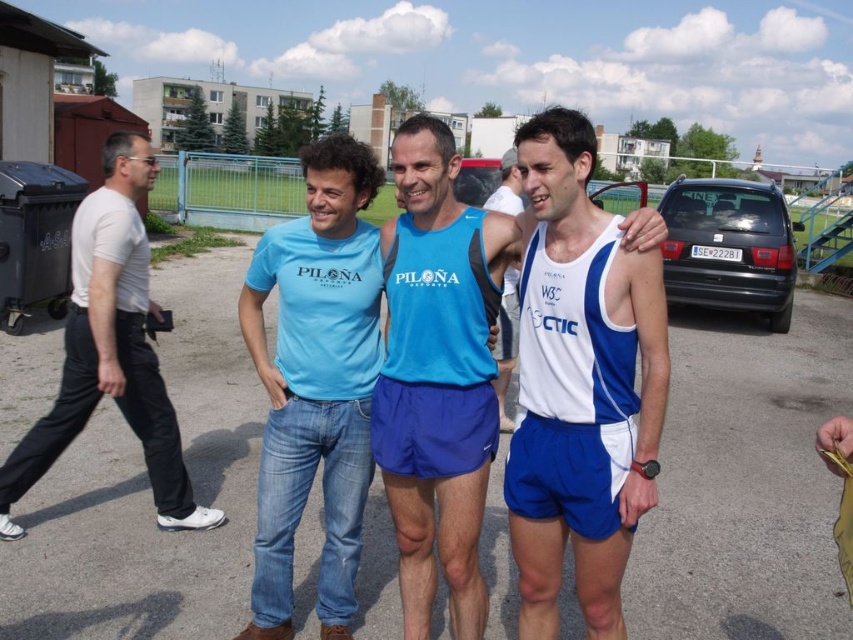
Does white/blue athletic tank top at center have a smaller size compared to white/blue athletic shorts at center?

Correct, white/blue athletic tank top at center occupies less space than white/blue athletic shorts at center.

Which is in front, point (608, 563) or point (502, 164)?

Positioned in front is point (608, 563).

Identify the location of white/blue athletic tank top at center. (x=579, y=387).

Can you confirm if white/blue athletic tank top at center is wider than white matte t-shirt at left?

No.

In the scene shown: Does white/blue athletic tank top at center have a smaller size compared to white matte t-shirt at left?

Yes, white/blue athletic tank top at center is smaller than white matte t-shirt at left.

The image size is (853, 640). Find the location of `white/blue athletic tank top at center`. white/blue athletic tank top at center is located at coordinates (579, 387).

Which is in front, point (383, 500) or point (329, 380)?

Point (329, 380)

Is blue fabric shorts at center smaller than light blue cotton t-shirt at center?

No.

Locate an element on the screen. Image resolution: width=853 pixels, height=640 pixels. blue fabric shorts at center is located at coordinates (746, 484).